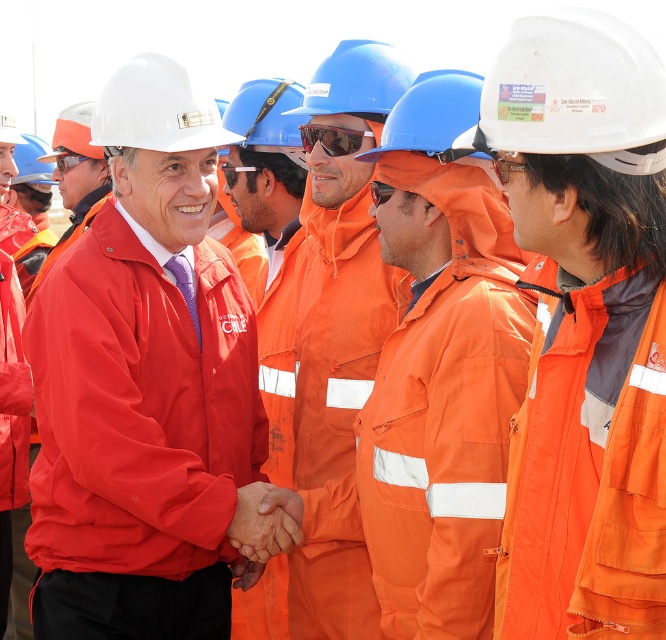
Based on the photo, you are an inspector at a construction site. You need to report the position of the orange matte hard hat at center relative to the white hard hat at upper left. What is the relationship between their positions?

The orange matte hard hat at center is positioned below the white hard hat at upper left.

You are a safety inspector at the construction site. You need to ensure that the orange matte hard hat at center and the white hard hat at upper left meet the minimum width requirement of 15 cm. Which hard hat is more likely to comply with the regulation?

→ The orange matte hard hat at center has a lesser width compared to the white hard hat at upper left. Since the minimum requirement is 15 cm, the white hard hat at upper left is more likely to comply with the regulation as it has a greater width.